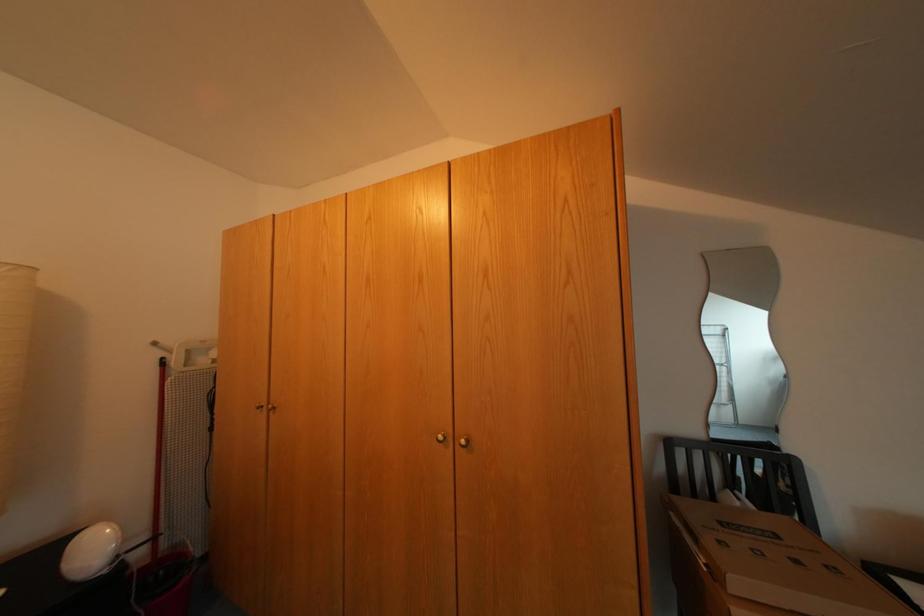
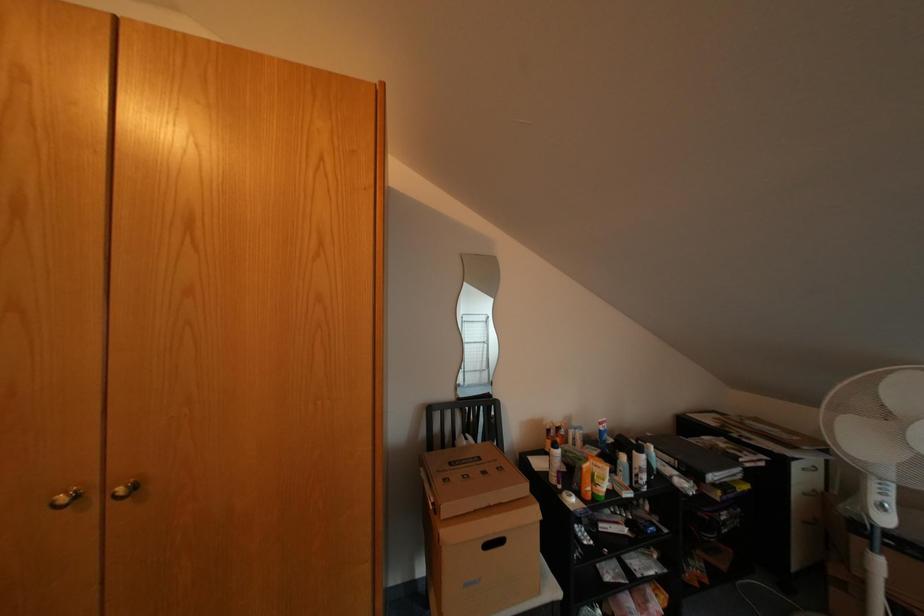
Question: Based on the continuous images, in which direction is the camera rotating? Reply with the corresponding letter.

Choices:
 (A) Left
 (B) Right
 (C) Up
 (D) Down

Answer: (B)